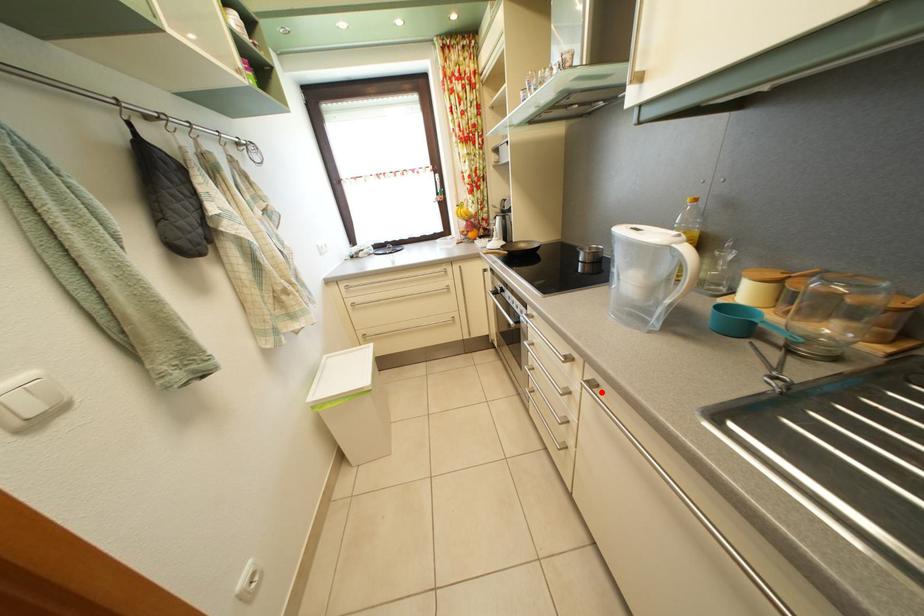
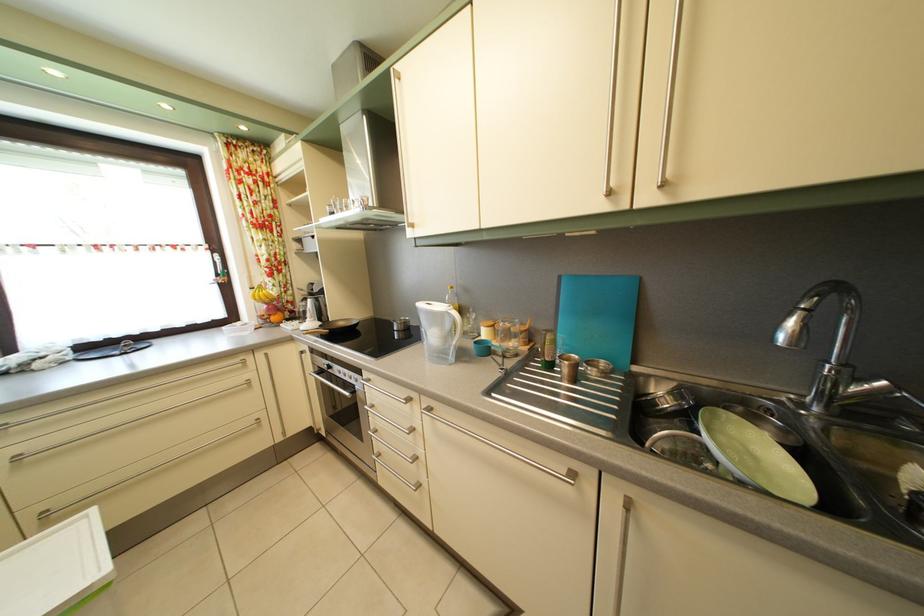
Question: I am providing you with two images of the same scene from different viewpoints. Given a red point in image1, look at the same physical point in image2. Is it:

Choices:
 (A) Closer to the viewpoint
 (B) Farther from the viewpoint

Answer: (B)